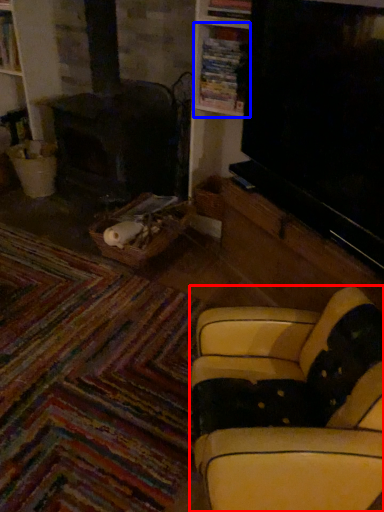
Question: Which object is closer to the camera taking this photo, studio couch (highlighted by a red box) or shelf (highlighted by a blue box)?

Choices:
 (A) studio couch
 (B) shelf

Answer: (A)